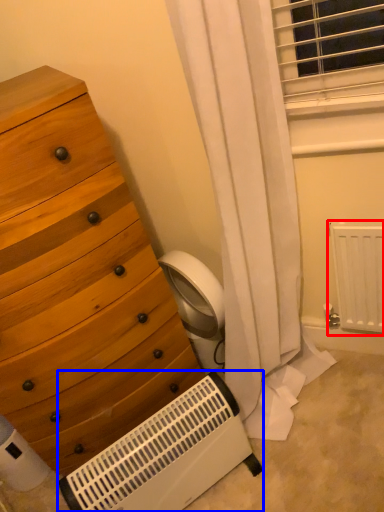
Question: Which point is closer to the camera, radiator (highlighted by a red box) or heater (highlighted by a blue box)?

Choices:
 (A) radiator
 (B) heater

Answer: (B)